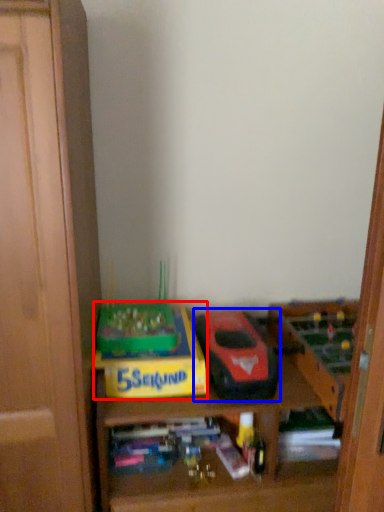
Question: Which point is further to the camera, cardboard box (highlighted by a red box) or model car (highlighted by a blue box)?

Choices:
 (A) cardboard box
 (B) model car

Answer: (A)